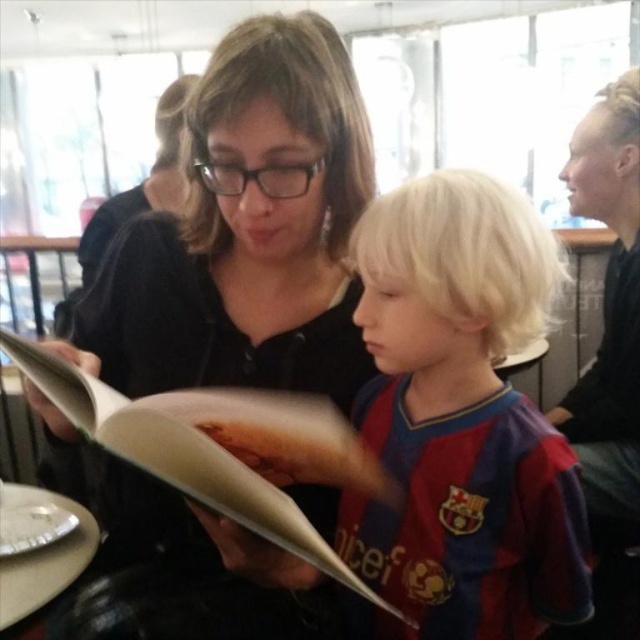
Is matte black shirt at center above red striped jersey at center?

Correct, matte black shirt at center is located above red striped jersey at center.

Does point (131, 540) come behind point (458, 532)?

Yes, it is behind point (458, 532).

Find the location of a particular element. matte black shirt at center is located at coordinates (246, 232).

Is red striped jersey at center behind metallic silver plate at lower left?

No, it is in front of metallic silver plate at lower left.

Which is above, red striped jersey at center or metallic silver plate at lower left?

red striped jersey at center is higher up.

Which is in front, point (477, 394) or point (65, 582)?

Positioned in front is point (477, 394).

In order to click on red striped jersey at center in this screenshot , I will do `click(461, 419)`.

Is matte paper book at center to the right of brown crumbly bread at center from the viewer's perspective?

No, matte paper book at center is not to the right of brown crumbly bread at center.

Between matte paper book at center and brown crumbly bread at center, which one appears on the left side from the viewer's perspective?

Positioned to the left is matte paper book at center.

Who is more forward, (371, 492) or (314, 467)?

Point (314, 467) is more forward.

Where is `matte paper book at center`? The height and width of the screenshot is (640, 640). matte paper book at center is located at coordinates (221, 449).